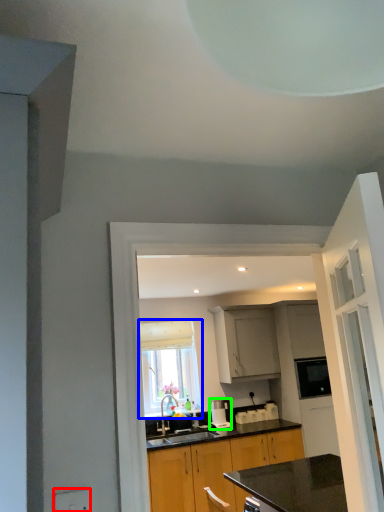
Question: Which object is positioned closest to electric outlet (highlighted by a red box)? Select from window (highlighted by a blue box) and coffee machine (highlighted by a green box).

Choices:
 (A) window
 (B) coffee machine

Answer: (B)